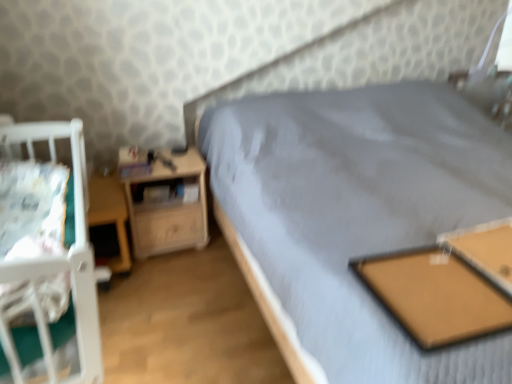
Question: From a real-world perspective, is wooden table at lower left, which is counted as the second table, starting from the front, below brown cork board at center, which appears as the first table when viewed from the right?

Choices:
 (A) no
 (B) yes

Answer: (B)

Question: Is wooden table at lower left, which is counted as the second table, starting from the right, taller than brown cork board at center, the first table viewed from the front?

Choices:
 (A) no
 (B) yes

Answer: (B)

Question: From the image's perspective, would you say wooden table at lower left, which is counted as the second table, starting from the front, is positioned over brown cork board at center, marked as the second table in a back-to-front arrangement?

Choices:
 (A) no
 (B) yes

Answer: (B)

Question: Is wooden table at lower left, marked as the 1th table in a left-to-right arrangement, to the left of brown cork board at center, which appears as the first table when viewed from the right, from the viewer's perspective?

Choices:
 (A) yes
 (B) no

Answer: (A)

Question: Is wooden table at lower left, which is counted as the first table, starting from the back, far from brown cork board at center, marked as the second table in a back-to-front arrangement?

Choices:
 (A) no
 (B) yes

Answer: (B)

Question: Is wooden table at lower left, marked as the 1th table in a left-to-right arrangement, facing away from brown cork board at center, marked as the second table in a back-to-front arrangement?

Choices:
 (A) no
 (B) yes

Answer: (A)

Question: Is wooden nightstand at left positioned behind wooden table at lower left, which is counted as the second table, starting from the front?

Choices:
 (A) yes
 (B) no

Answer: (A)

Question: Is wooden nightstand at left far from wooden table at lower left, which is counted as the first table, starting from the back?

Choices:
 (A) no
 (B) yes

Answer: (A)

Question: Is wooden nightstand at left turned away from wooden table at lower left, marked as the 1th table in a left-to-right arrangement?

Choices:
 (A) no
 (B) yes

Answer: (A)

Question: Can we say wooden nightstand at left lies outside wooden table at lower left, marked as the 1th table in a left-to-right arrangement?

Choices:
 (A) yes
 (B) no

Answer: (A)

Question: Is wooden nightstand at left bigger than wooden table at lower left, which is counted as the second table, starting from the right?

Choices:
 (A) yes
 (B) no

Answer: (A)

Question: Considering the relative sizes of wooden nightstand at left and wooden table at lower left, which is counted as the first table, starting from the back, in the image provided, is wooden nightstand at left shorter than wooden table at lower left, which is counted as the first table, starting from the back,?

Choices:
 (A) no
 (B) yes

Answer: (A)

Question: Can you confirm if white fabric sheet at left is positioned to the left of wooden table at lower left, which is counted as the second table, starting from the front?

Choices:
 (A) no
 (B) yes

Answer: (A)